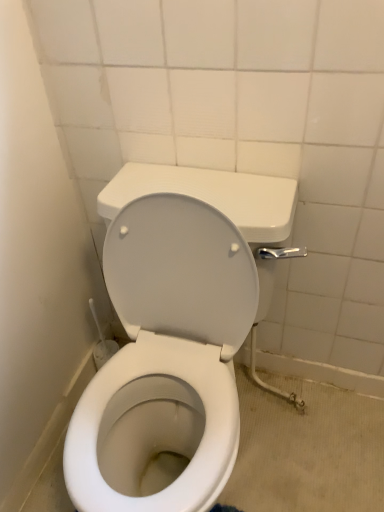
Find the location of a particular element. white glossy toilet at center is located at coordinates (166, 358).

Describe the element at coordinates (166, 358) in the screenshot. I see `white glossy toilet at center` at that location.

This screenshot has width=384, height=512. Find the location of `white glossy toilet at center`. white glossy toilet at center is located at coordinates (166, 358).